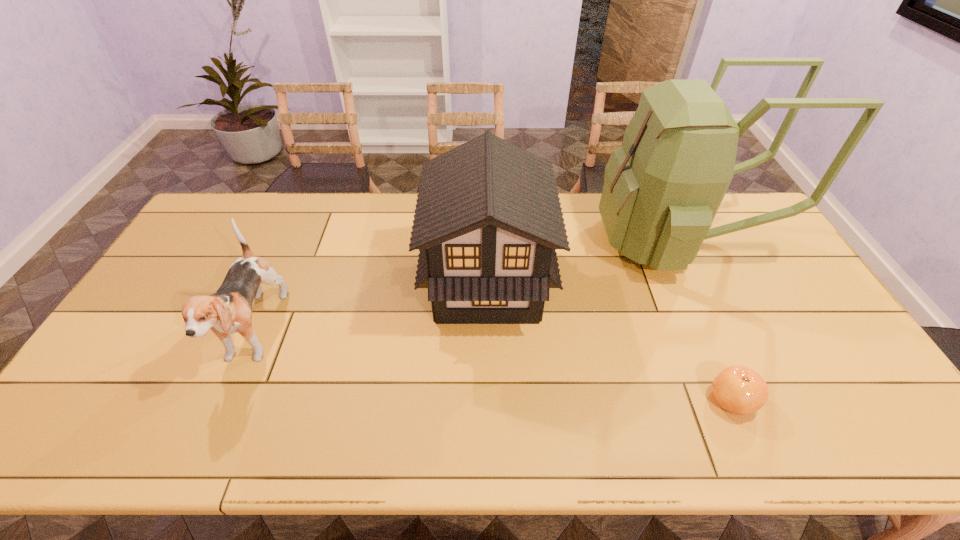
Find the location of a particular element. The height and width of the screenshot is (540, 960). free space that satisfies the following two spatial constraints: 1. on the front-facing side of the dollhouse; 2. at the face of the leftmost object is located at coordinates (488, 334).

Find the location of `vacant region that satisfies the following two spatial constraints: 1. on the front-facing side of the shortest object; 2. on the left side of the dollhouse`. vacant region that satisfies the following two spatial constraints: 1. on the front-facing side of the shortest object; 2. on the left side of the dollhouse is located at coordinates (489, 400).

At what (x,y) coordinates should I click in order to perform the action: click on blank space that satisfies the following two spatial constraints: 1. on the front pocket of the tallest object; 2. on the front side of the clementine. Please return your answer as a coordinate pair (x, y). The width and height of the screenshot is (960, 540). Looking at the image, I should click on (752, 400).